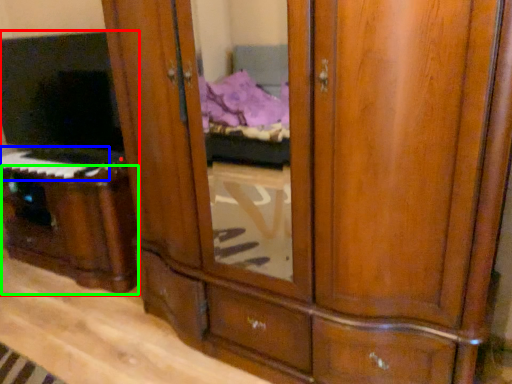
Question: Which object is positioned closest to entertainment center (highlighted by a red box)? Select from musical keyboard (highlighted by a blue box) and vanity (highlighted by a green box).

Choices:
 (A) musical keyboard
 (B) vanity

Answer: (B)